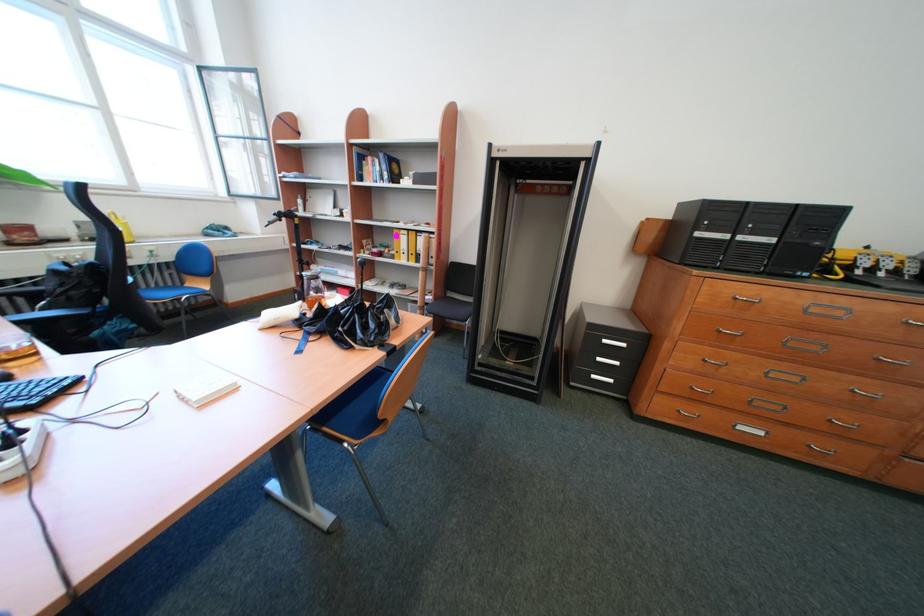
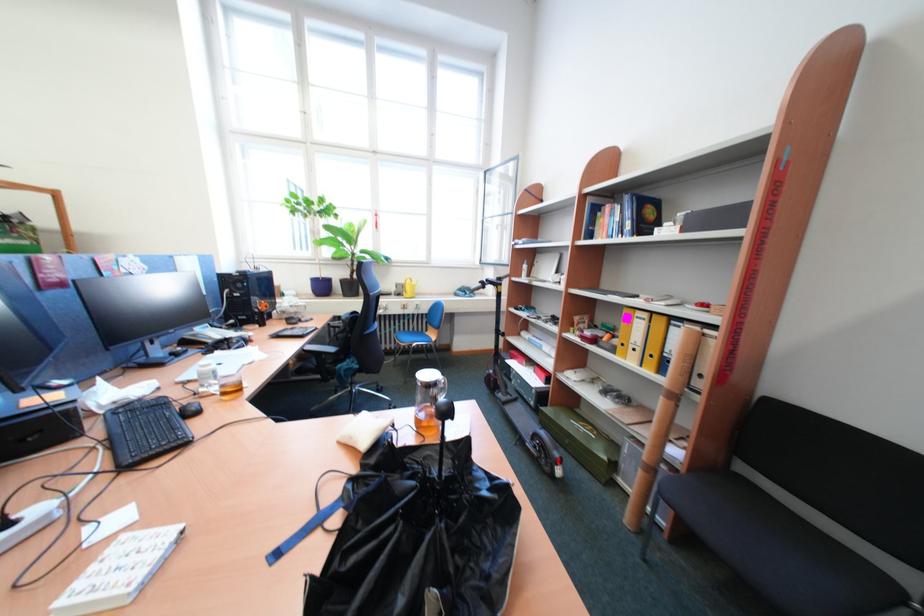
The point at (79, 243) is marked in the first image. Where is the corresponding point in the second image?

(403, 296)